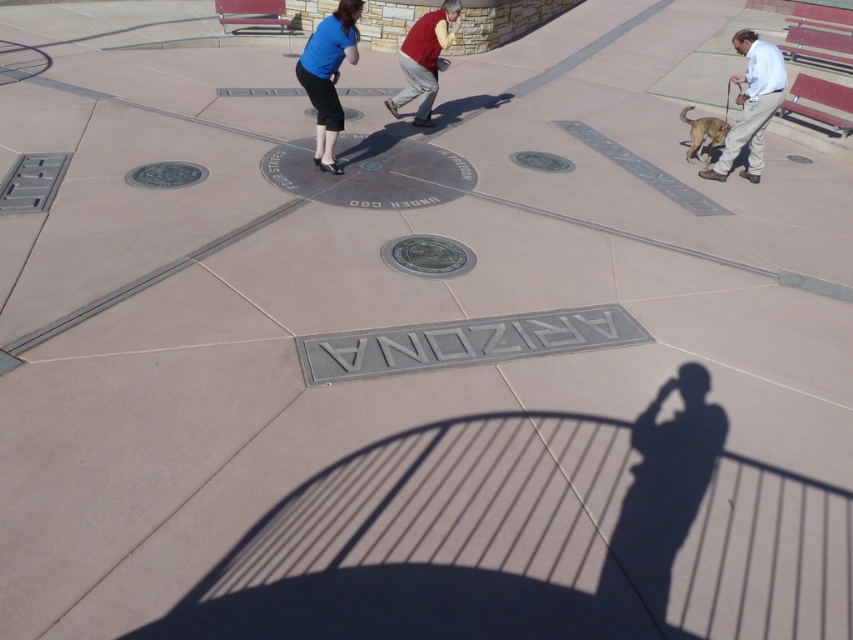
Does silhouette shadow at center have a lesser height compared to matte blue skirt at upper center?

Correct, silhouette shadow at center is not as tall as matte blue skirt at upper center.

Does point (663, 557) lie in front of point (349, 45)?

Yes, point (663, 557) is closer to viewer.

Find the location of a particular element. silhouette shadow at center is located at coordinates (660, 499).

Between matte blue skirt at upper center and matte red shirt at center, which one is positioned lower?

matte blue skirt at upper center

Is matte blue skirt at upper center above matte red shirt at center?

No.

Measure the distance between point (354, 0) and camera.

The distance of point (354, 0) from camera is 5.43 meters.

You are a GUI agent. You are given a task and a screenshot of the screen. Output one action in this format:
    pyautogui.click(x=<x>, y=<y>)
    Task: Click on the matte blue skirt at upper center
    This screenshot has width=853, height=640.
    Given the screenshot: What is the action you would take?
    pyautogui.click(x=328, y=76)

Who is higher up, matte blue skirt at upper center or light beige pants at right?

light beige pants at right

Between matte blue skirt at upper center and light beige pants at right, which one is positioned lower?

matte blue skirt at upper center is lower down.

What are the coordinates of `matte blue skirt at upper center` in the screenshot? It's located at (328, 76).